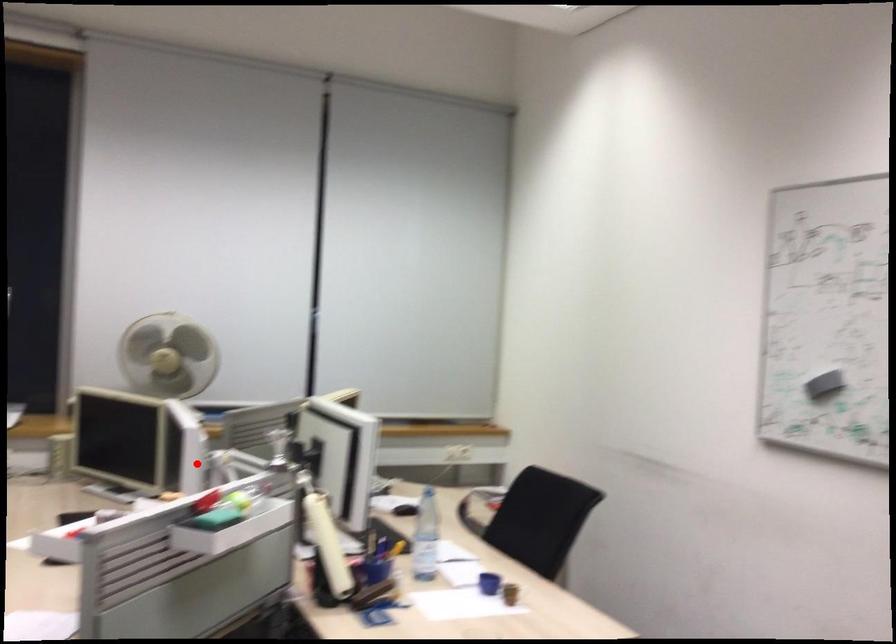
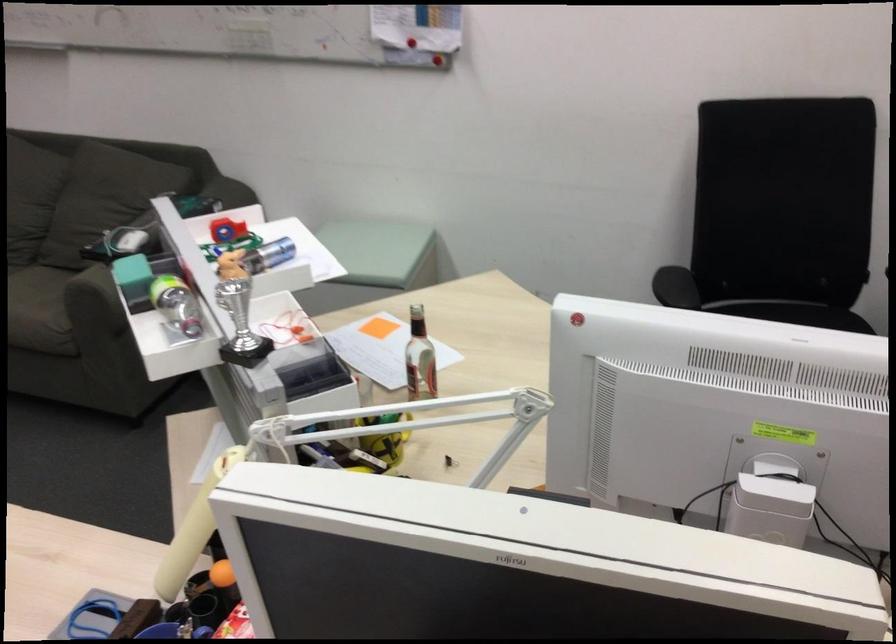
Question: I am providing you with two images of the same scene from different viewpoints. A red point is marked on the first image. Is the red point's position out of view in image 2?

Choices:
 (A) Yes
 (B) No

Answer: (B)